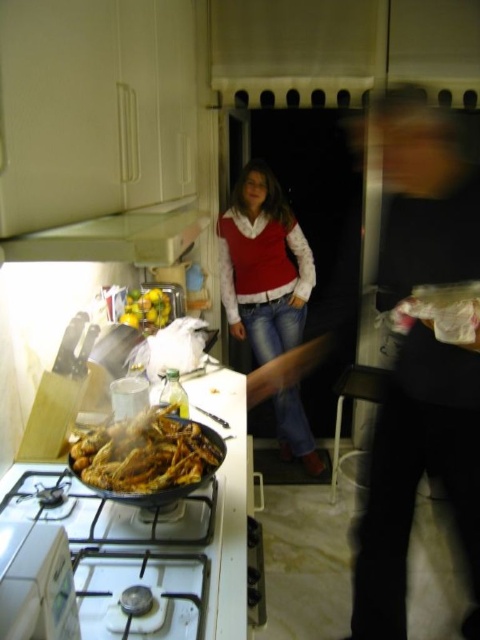
Question: Which point is closer to the camera?

Choices:
 (A) (88, 465)
 (B) (295, 304)
 (C) (55, 230)
 (D) (93, 497)

Answer: (C)

Question: Is red knit sweater at center thinner than white matte exhaust hood at upper left?

Choices:
 (A) yes
 (B) no

Answer: (B)

Question: Which of the following is the farthest from the observer?

Choices:
 (A) red knit sweater at center
 (B) white matte exhaust hood at upper left
 (C) golden crispy chicken at center

Answer: (A)

Question: Does red knit sweater at center appear on the left side of golden crispy chicken at center?

Choices:
 (A) yes
 (B) no

Answer: (B)

Question: Which of these objects is positioned closest to the golden crispy chicken at center?

Choices:
 (A) smooth black shirt at right
 (B) red knit sweater at center
 (C) white glossy gas stove at lower left

Answer: (C)

Question: Does red knit sweater at center lie in front of golden crispy chicken at center?

Choices:
 (A) yes
 (B) no

Answer: (B)